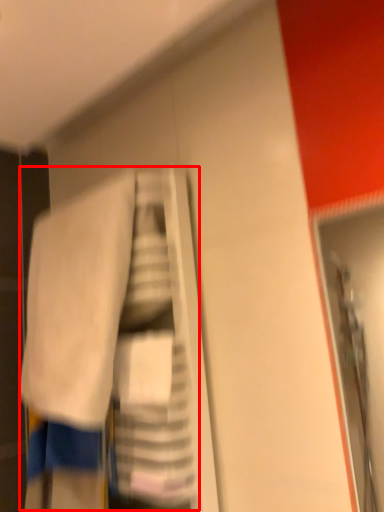
Question: From the image's perspective, what is the correct spatial positioning of laundry (annotated by the red box) in reference to towel?

Choices:
 (A) above
 (B) below

Answer: (B)